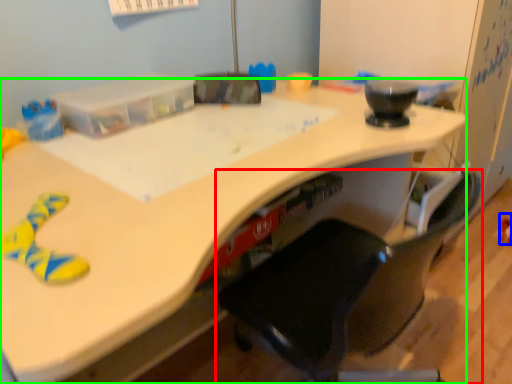
Question: Which is farther away from chair (highlighted by a red box)? toy (highlighted by a blue box) or desk (highlighted by a green box)?

Choices:
 (A) toy
 (B) desk

Answer: (A)